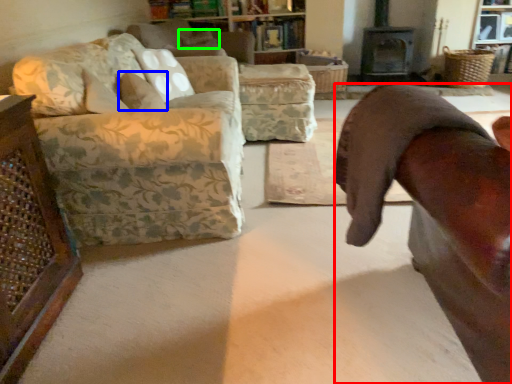
Question: Considering the real-world distances, which object is closest to chair (highlighted by a red box)? pillow (highlighted by a blue box) or pillow (highlighted by a green box).

Choices:
 (A) pillow
 (B) pillow

Answer: (A)